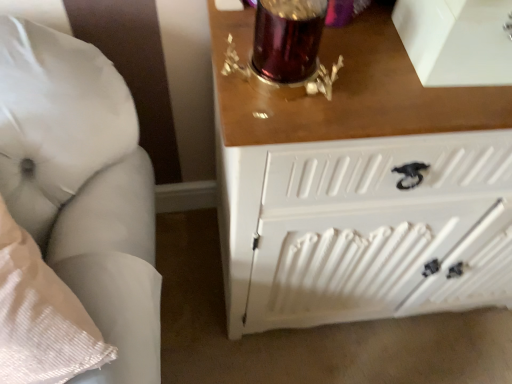
Question: Is white fabric pillow at left facing towards white painted wood radiator at lower right?

Choices:
 (A) yes
 (B) no

Answer: (B)

Question: Considering the relative sizes of white fabric pillow at left and white painted wood radiator at lower right in the image provided, is white fabric pillow at left thinner than white painted wood radiator at lower right?

Choices:
 (A) yes
 (B) no

Answer: (A)

Question: Does white fabric pillow at left have a larger size compared to white painted wood radiator at lower right?

Choices:
 (A) yes
 (B) no

Answer: (A)

Question: Are white fabric pillow at left and white painted wood radiator at lower right far apart?

Choices:
 (A) yes
 (B) no

Answer: (B)

Question: Could white painted wood radiator at lower right be considered to be inside white fabric pillow at left?

Choices:
 (A) no
 (B) yes

Answer: (A)

Question: Is white fabric pillow at left outside of white painted wood radiator at lower right?

Choices:
 (A) yes
 (B) no

Answer: (A)

Question: Can you confirm if white painted wood radiator at lower right is taller than white fabric pillow at left?

Choices:
 (A) no
 (B) yes

Answer: (A)

Question: Is white painted wood radiator at lower right next to white fabric pillow at left and touching it?

Choices:
 (A) yes
 (B) no

Answer: (B)

Question: Is white fabric pillow at left at the back of white painted wood radiator at lower right?

Choices:
 (A) yes
 (B) no

Answer: (B)

Question: From a real-world perspective, is white painted wood radiator at lower right under white fabric pillow at left?

Choices:
 (A) no
 (B) yes

Answer: (B)

Question: Can you confirm if white painted wood radiator at lower right is positioned to the left of white fabric pillow at left?

Choices:
 (A) no
 (B) yes

Answer: (A)

Question: Is white painted wood radiator at lower right shorter than white fabric pillow at left?

Choices:
 (A) no
 (B) yes

Answer: (B)

Question: Based on their sizes in the image, would you say white painted wood radiator at lower right is bigger or smaller than white fabric pillow at left?

Choices:
 (A) small
 (B) big

Answer: (A)